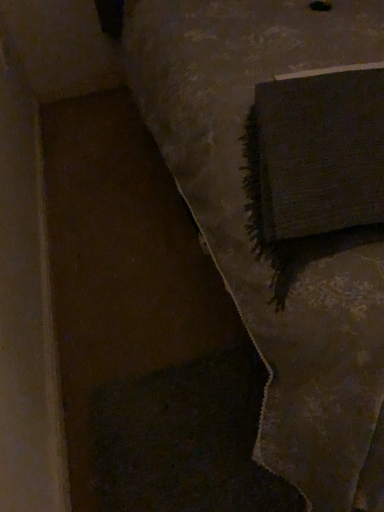
Describe the element at coordinates (320, 5) in the screenshot. I see `black matte hole at upper right` at that location.

Locate an element on the screen. This screenshot has height=512, width=384. black matte hole at upper right is located at coordinates (320, 5).

Measure the distance between point [323,10] and camera.

Point [323,10] is 1.29 meters from camera.

Find the location of a particular element. black matte hole at upper right is located at coordinates (320, 5).